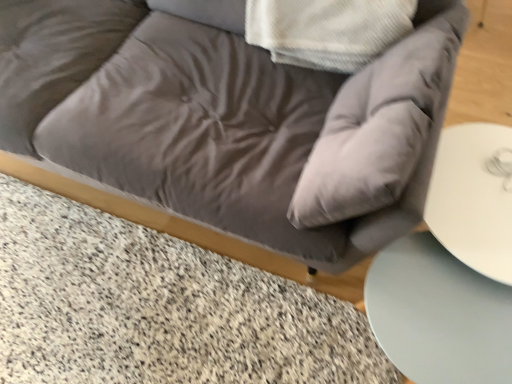
Question: Are satin gray couch at center and granite textured marble at lower left located far from each other?

Choices:
 (A) no
 (B) yes

Answer: (A)

Question: From a real-world perspective, does satin gray couch at center sit lower than granite textured marble at lower left?

Choices:
 (A) yes
 (B) no

Answer: (B)

Question: Does satin gray couch at center lie in front of granite textured marble at lower left?

Choices:
 (A) yes
 (B) no

Answer: (A)

Question: Can you confirm if satin gray couch at center is thinner than granite textured marble at lower left?

Choices:
 (A) no
 (B) yes

Answer: (A)

Question: Is satin gray couch at center outside of granite textured marble at lower left?

Choices:
 (A) no
 (B) yes

Answer: (B)

Question: Does satin gray couch at center have a greater width compared to granite textured marble at lower left?

Choices:
 (A) yes
 (B) no

Answer: (A)

Question: Would you consider granite textured marble at lower left to be distant from satin gray couch at center?

Choices:
 (A) yes
 (B) no

Answer: (B)

Question: Is granite textured marble at lower left positioned with its back to satin gray couch at center?

Choices:
 (A) no
 (B) yes

Answer: (A)

Question: Is granite textured marble at lower left taller than satin gray couch at center?

Choices:
 (A) yes
 (B) no

Answer: (B)

Question: From a real-world perspective, is granite textured marble at lower left physically below satin gray couch at center?

Choices:
 (A) yes
 (B) no

Answer: (A)

Question: From a real-world perspective, is granite textured marble at lower left positioned over satin gray couch at center based on gravity?

Choices:
 (A) no
 (B) yes

Answer: (A)

Question: Considering the relative sizes of granite textured marble at lower left and satin gray couch at center in the image provided, is granite textured marble at lower left bigger than satin gray couch at center?

Choices:
 (A) yes
 (B) no

Answer: (B)

Question: Can you confirm if smooth white table at lower right is shorter than satin gray couch at center?

Choices:
 (A) yes
 (B) no

Answer: (A)